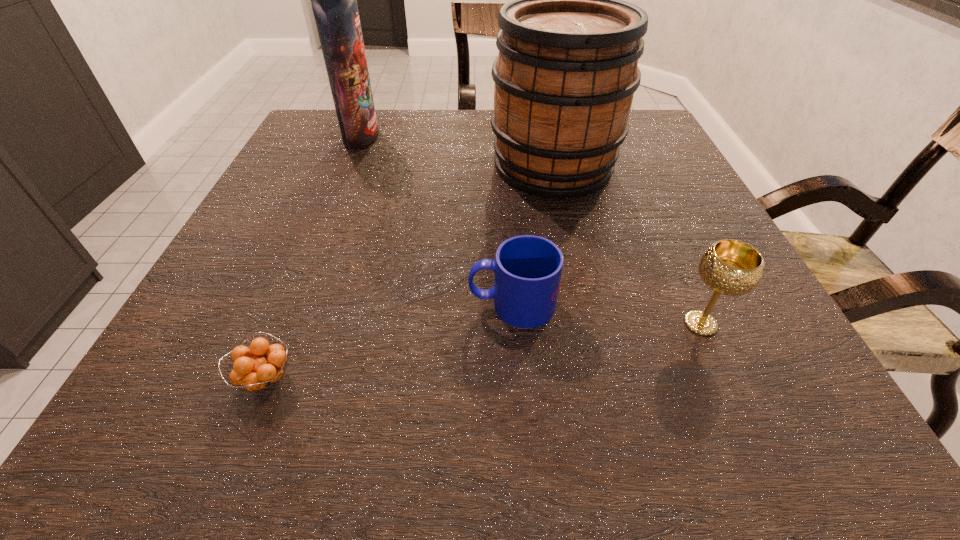
I want to click on vacant point that satisfies the following two spatial constraints: 1. on the side with the handle of the mug; 2. on the right side of the chalice, so click(x=514, y=323).

This screenshot has height=540, width=960. I want to click on free point that satisfies the following two spatial constraints: 1. on the front label of the third shortest object; 2. on the left side of the shampoo, so click(287, 323).

Image resolution: width=960 pixels, height=540 pixels. I want to click on free space in the image that satisfies the following two spatial constraints: 1. on the front label of the shampoo; 2. on the left side of the chalice, so click(287, 323).

You are a GUI agent. You are given a task and a screenshot of the screen. Output one action in this format:
    pyautogui.click(x=<x>, y=<y>)
    Task: Click on the blank area in the image that satisfies the following two spatial constraints: 1. on the side with the handle of the third shortest object; 2. on the right side of the mug
    The height and width of the screenshot is (540, 960).
    Given the screenshot: What is the action you would take?
    pyautogui.click(x=514, y=323)

You are a GUI agent. You are given a task and a screenshot of the screen. Output one action in this format:
    pyautogui.click(x=<x>, y=<y>)
    Task: Click on the blank area in the image that satisfies the following two spatial constraints: 1. on the front label of the third shortest object; 2. on the right side of the shampoo
    The image size is (960, 540).
    Given the screenshot: What is the action you would take?
    pyautogui.click(x=287, y=323)

Find the location of `free space that satisfies the following two spatial constraints: 1. on the front label of the shampoo; 2. on the right side of the shortest object`. free space that satisfies the following two spatial constraints: 1. on the front label of the shampoo; 2. on the right side of the shortest object is located at coordinates (266, 379).